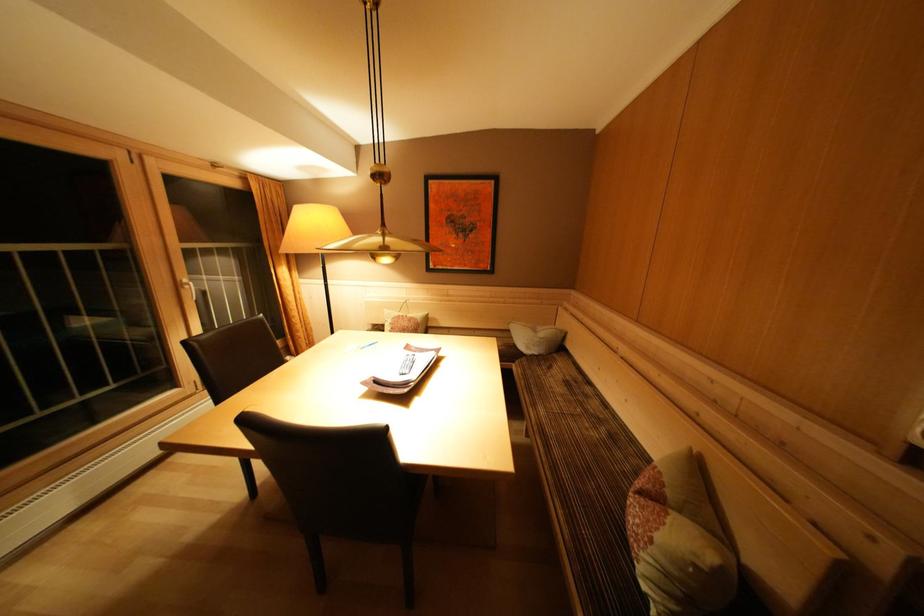
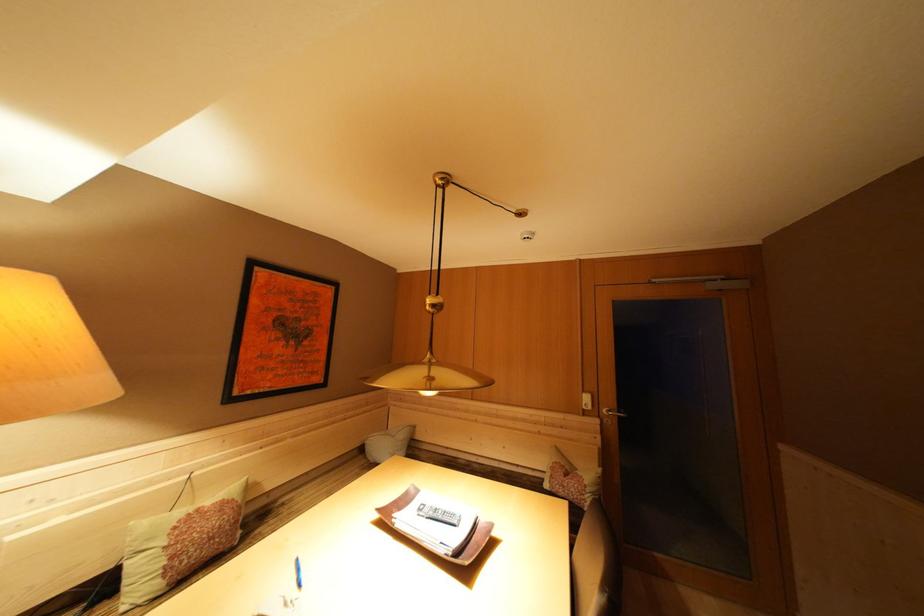
Where in the second image is the point corresponding to (x=391, y=241) from the first image?

(438, 369)